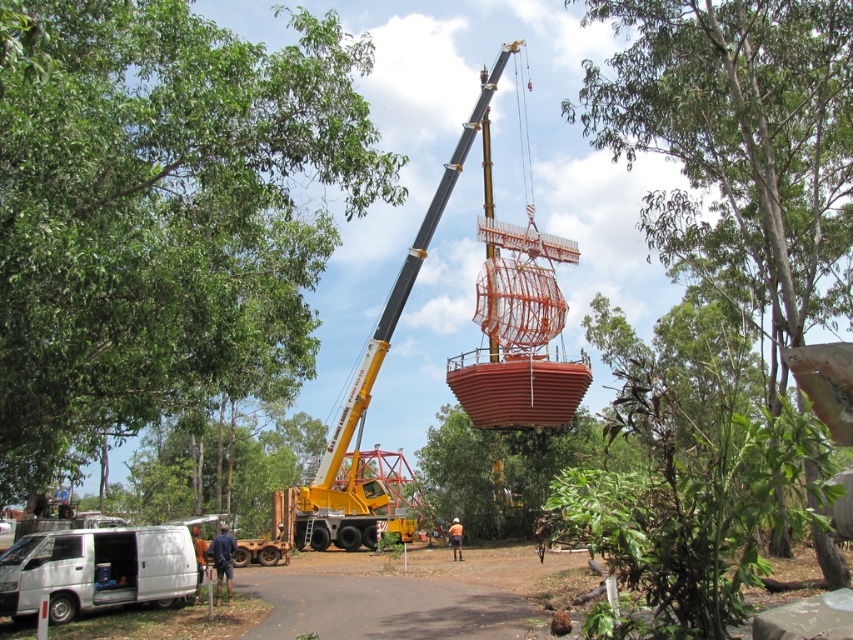
You are standing at the center of the image. Which object, the green leafy tree at upper left or the brown leather jacket at lower left, appears wider from your perspective?

The green leafy tree at upper left appears wider than the brown leather jacket at lower left because its width surpasses the jacket.

You are standing at the position of the white van parked on the left side of the image. Looking towards the crane lifting the orange and red structure, where is the green leafy tree at center relative to your viewpoint?

The green leafy tree at center is located at point 0.734 on the x axis and 0.586 on the y axis relative to your viewpoint.

Looking at this image, you are a delivery driver who needs to park your truck behind the white matte van at lower left and the brown leather jacket at lower left. Can you park your truck there without blocking the entrance?

The white matte van at lower left is to the left of brown leather jacket at lower left. Since the van is parked and the jacket is near it, there might not be enough space between them to park your truck without blocking the entrance.